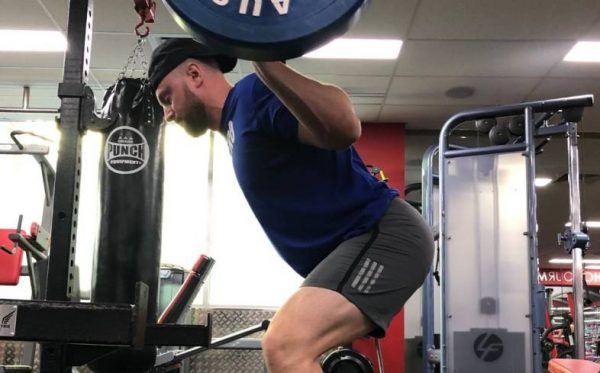
You are a GUI agent. You are given a task and a screenshot of the screen. Output one action in this format:
    pyautogui.click(x=<x>, y=<y>)
    Task: Click on the red cushion
    The height and width of the screenshot is (373, 600).
    Given the screenshot: What is the action you would take?
    pyautogui.click(x=8, y=265)